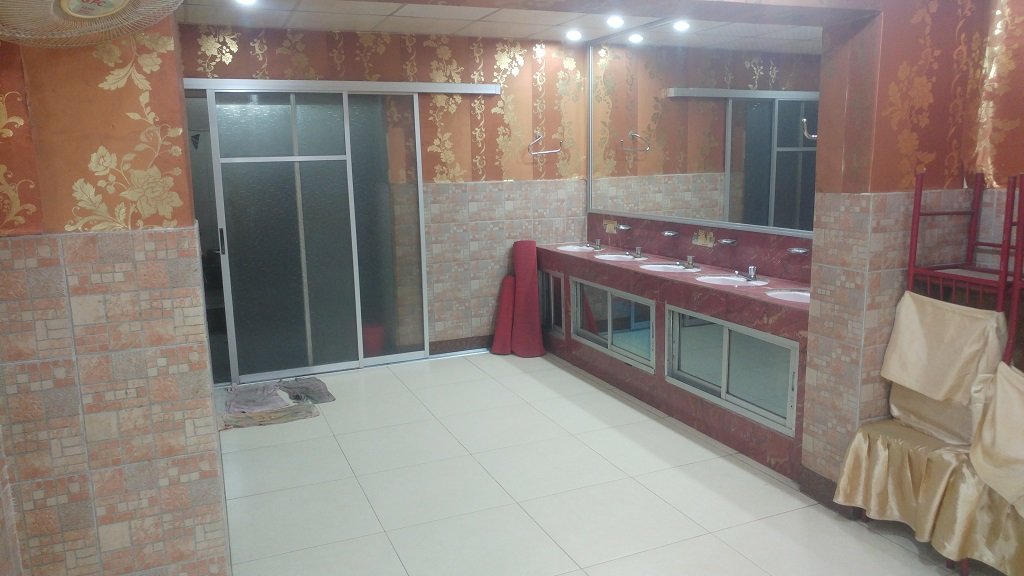
I want to click on ceiling, so click(464, 18).